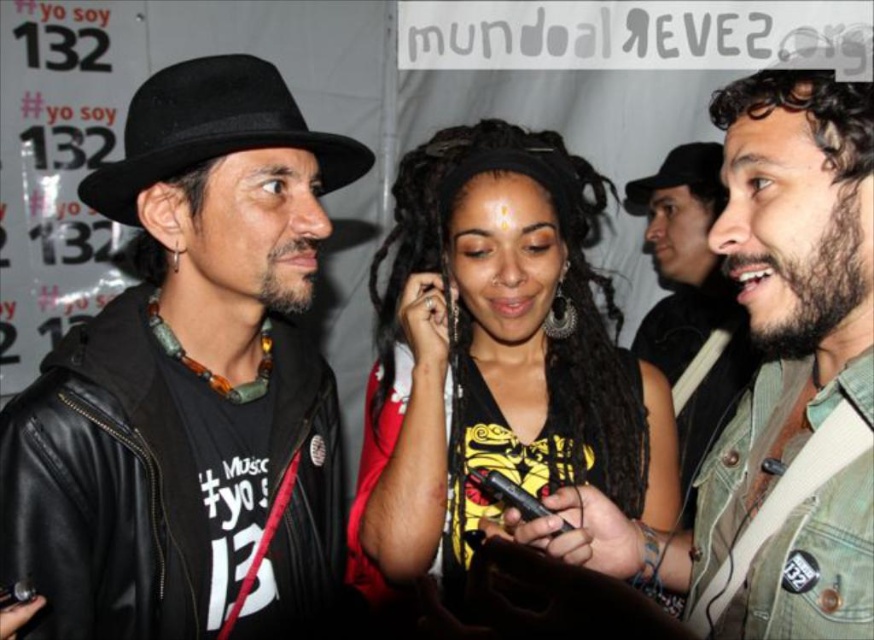
You are a photographer at the event and need to capture both the black leather hat at upper left and the black felt fedora at upper center in a single frame. Which hat should you position closer to the camera to ensure both are clearly visible?

To ensure both the black leather hat at upper left and the black felt fedora at upper center are clearly visible in the photo, position the black leather hat at upper left closer to the camera since it is larger in size than the black felt fedora at upper center. This way, the size difference will be balanced, and both hats will appear distinct in the frame.